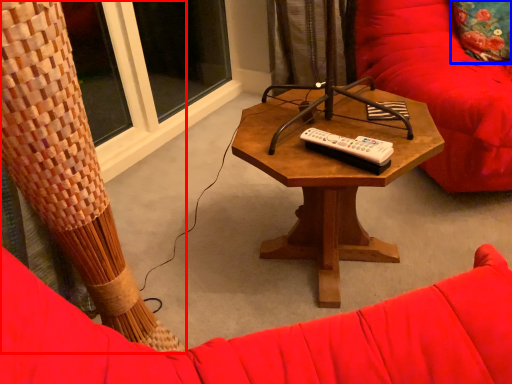
Question: Which object appears closest to the camera in this image, curtain (highlighted by a red box) or throw pillow (highlighted by a blue box)?

Choices:
 (A) curtain
 (B) throw pillow

Answer: (A)